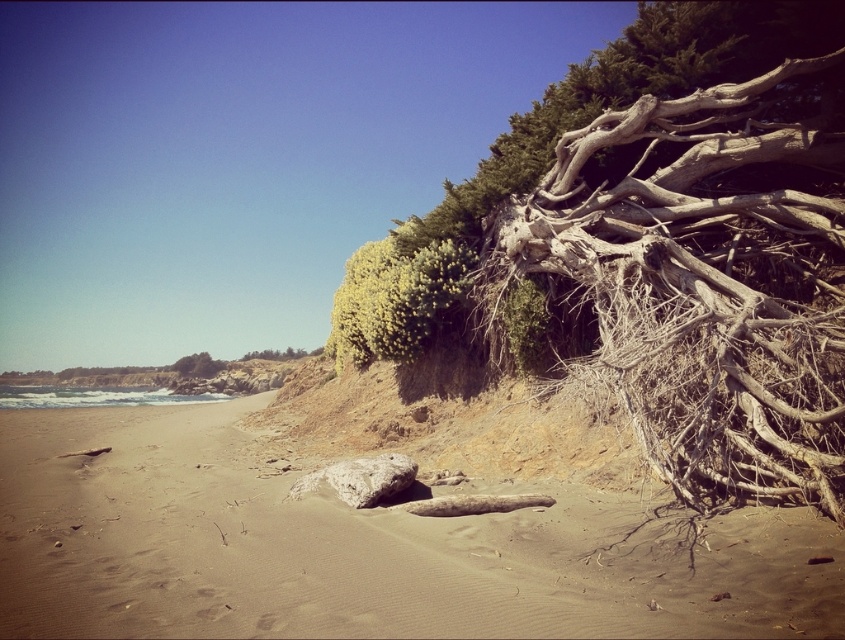
Can you confirm if driftwood at upper right is positioned below gray rough rock at center?

Incorrect, driftwood at upper right is not positioned below gray rough rock at center.

Is driftwood at upper right shorter than gray rough rock at center?

No, driftwood at upper right is not shorter than gray rough rock at center.

Locate an element on the screen. This screenshot has height=640, width=845. driftwood at upper right is located at coordinates (582, 128).

Who is higher up, brown sandy beach at lower center or driftwood at upper right?

Positioned higher is driftwood at upper right.

Image resolution: width=845 pixels, height=640 pixels. I want to click on brown sandy beach at lower center, so click(361, 548).

Locate an element on the screen. This screenshot has height=640, width=845. brown sandy beach at lower center is located at coordinates click(x=361, y=548).

Who is taller, brown sandy beach at lower center or gray rough rock at center?

Standing taller between the two is brown sandy beach at lower center.

Can you confirm if brown sandy beach at lower center is thinner than gray rough rock at center?

No.

What do you see at coordinates (361, 548) in the screenshot? Image resolution: width=845 pixels, height=640 pixels. I see `brown sandy beach at lower center` at bounding box center [361, 548].

Where is `brown sandy beach at lower center`? Image resolution: width=845 pixels, height=640 pixels. brown sandy beach at lower center is located at coordinates (361, 548).